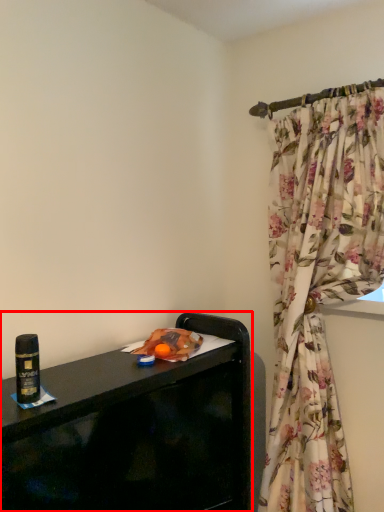
Question: Considering the relative positions of furniture (annotated by the red box) and beverage in the image provided, where is furniture (annotated by the red box) located with respect to the staircase?

Choices:
 (A) right
 (B) left

Answer: (A)